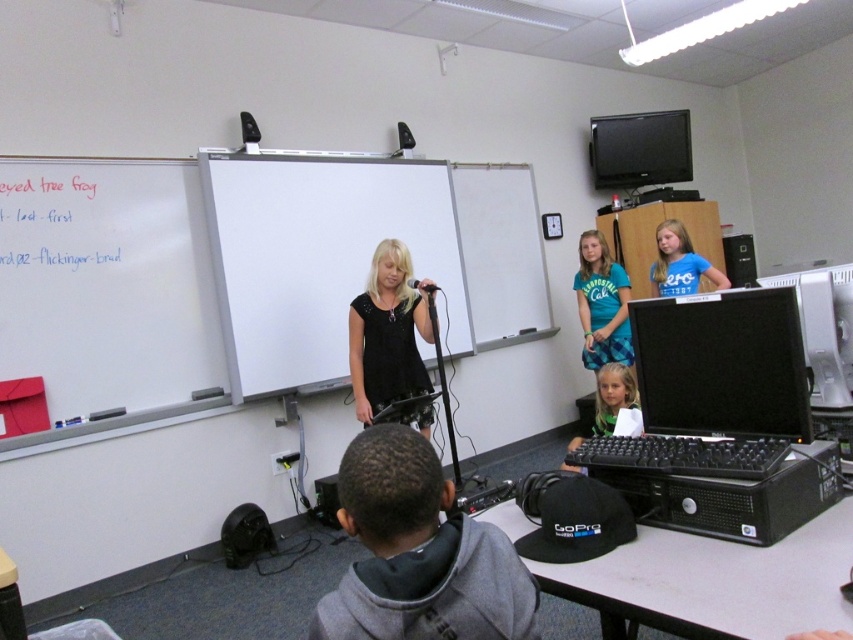
Based on the photo, you are a student sitting in the classroom and want to hand in your homework to the teacher who is wearing the blue plaid dress at center. However, there is a white plastic computer at right blocking your path. Can you walk around it to reach the teacher?

The white plastic computer at right is in front of the blue plaid dress at center, so you can walk around it to reach the teacher.

You are a photographer in the classroom. You need to capture a photo of the blue plaid dress at center and the matte black keyboard at lower center. Which object will appear larger in the photo?

The blue plaid dress at center will appear larger in the photo because it is much taller than the matte black keyboard at lower center.